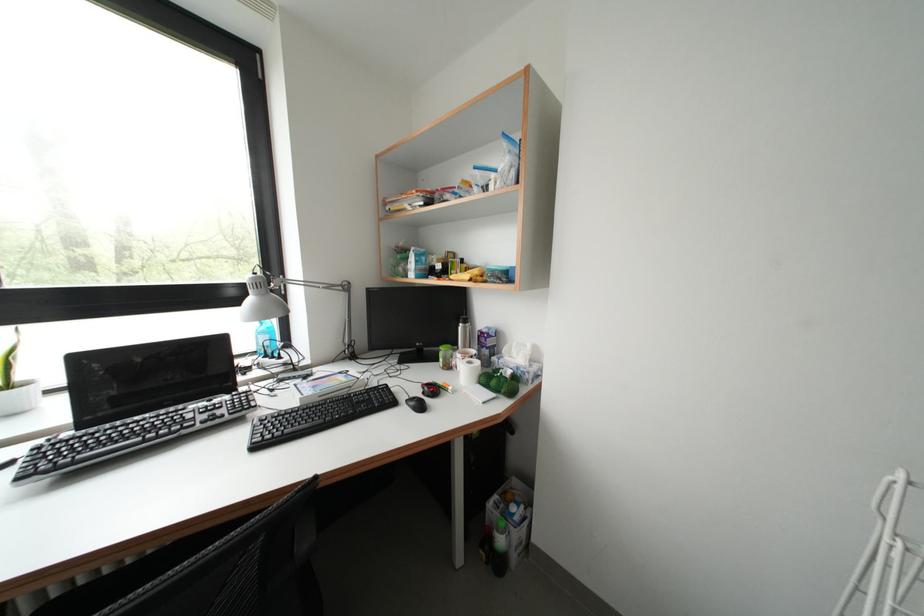
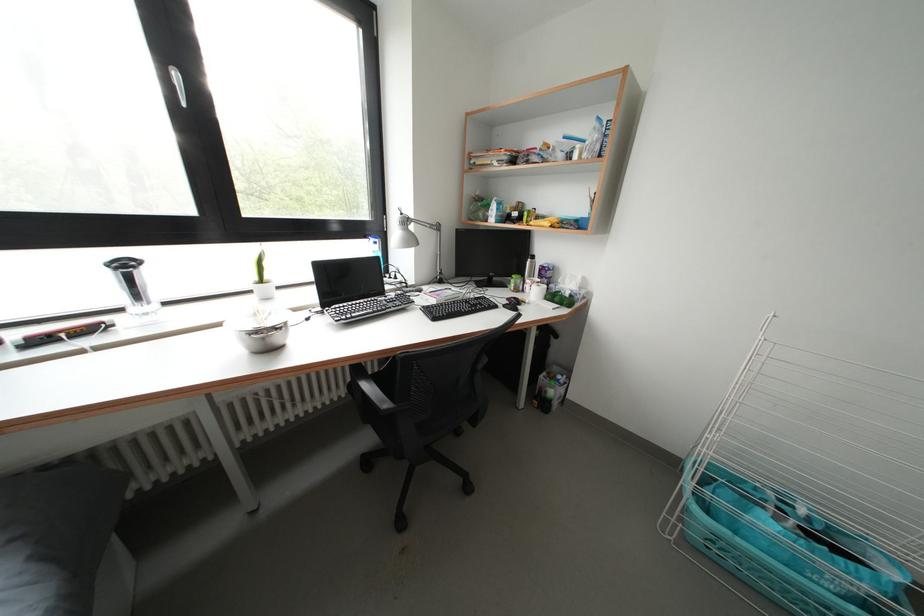
Where in the second image is the point corresponding to point (473, 275) from the first image?

(544, 223)